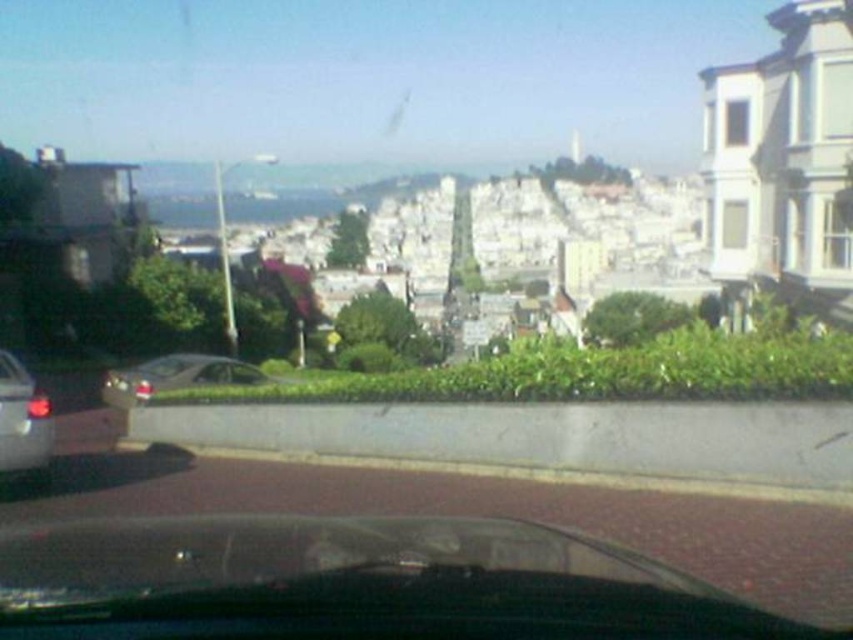
Question: Can you confirm if satin silver sedan at center is thinner than shiny silver car at left?

Choices:
 (A) no
 (B) yes

Answer: (A)

Question: Is satin silver sedan at center below shiny silver car at left?

Choices:
 (A) no
 (B) yes

Answer: (A)

Question: Which of the following is the farthest from the observer?

Choices:
 (A) shiny silver car at left
 (B) satin silver sedan at center

Answer: (B)

Question: Does satin silver sedan at center have a lesser width compared to shiny silver car at left?

Choices:
 (A) no
 (B) yes

Answer: (A)

Question: Which point is farther from the camera taking this photo?

Choices:
 (A) (28, 404)
 (B) (209, 376)

Answer: (B)